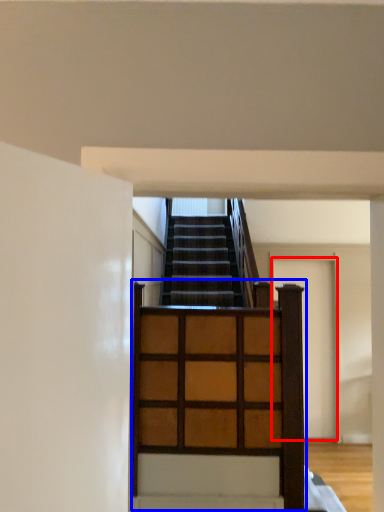
Question: Which point is closer to the camera, door (highlighted by a red box) or dresser (highlighted by a blue box)?

Choices:
 (A) door
 (B) dresser

Answer: (B)